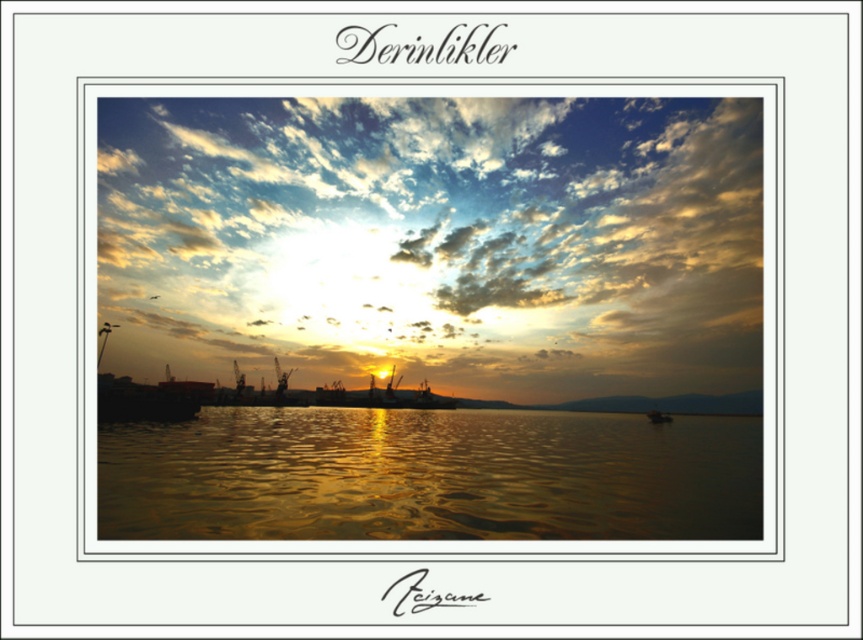
Is cloudy sky at upper center wider than metallic silver boat at center?

Yes.

Between cloudy sky at upper center and metallic silver boat at center, which one has more height?

Standing taller between the two is cloudy sky at upper center.

Is point (650, 241) positioned before point (666, 417)?

No, (650, 241) is behind (666, 417).

The width and height of the screenshot is (863, 640). What are the coordinates of `cloudy sky at upper center` in the screenshot? It's located at (438, 241).

What do you see at coordinates (438, 241) in the screenshot?
I see `cloudy sky at upper center` at bounding box center [438, 241].

Identify the location of cloudy sky at upper center. pyautogui.click(x=438, y=241).

Does point (487, 212) lie in front of point (208, 444)?

That is False.

Find the location of a particular element. This screenshot has height=640, width=863. cloudy sky at upper center is located at coordinates (438, 241).

Consider the image. Does golden reflective water at center appear over metallic silver boat at center?

Correct, golden reflective water at center is located above metallic silver boat at center.

Is golden reflective water at center bigger than metallic silver boat at center?

Incorrect, golden reflective water at center is not larger than metallic silver boat at center.

Locate an element on the screen. Image resolution: width=863 pixels, height=640 pixels. golden reflective water at center is located at coordinates (429, 476).